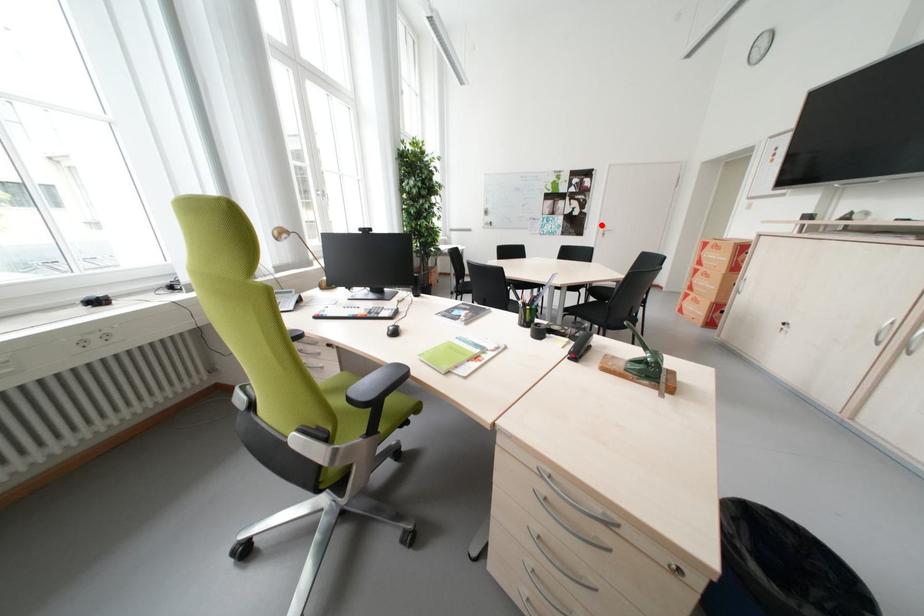
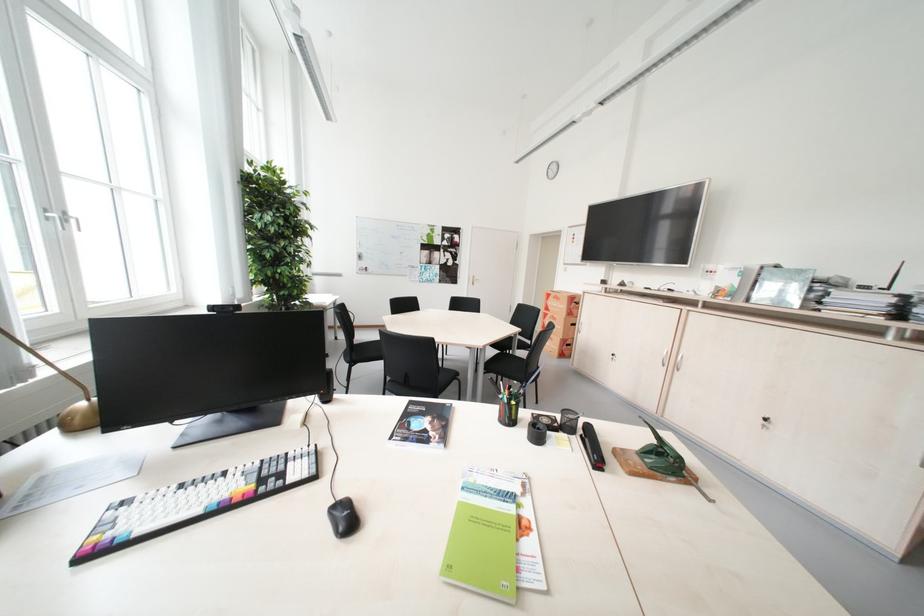
Find the pixel in the second image that matches the highlighted location in the first image.

(473, 275)